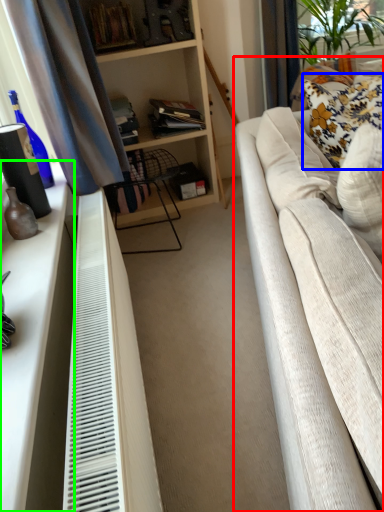
Question: Considering the real-world distances, which object is closest to studio couch (highlighted by a red box)? pillow (highlighted by a blue box) or dresser (highlighted by a green box).

Choices:
 (A) pillow
 (B) dresser

Answer: (B)